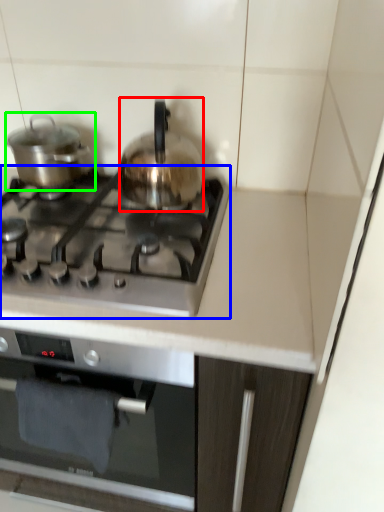
Question: Which object is the farthest from kitchen appliance (highlighted by a red box)? Choose among these: gas stove (highlighted by a blue box) or kitchen appliance (highlighted by a green box).

Choices:
 (A) gas stove
 (B) kitchen appliance

Answer: (B)